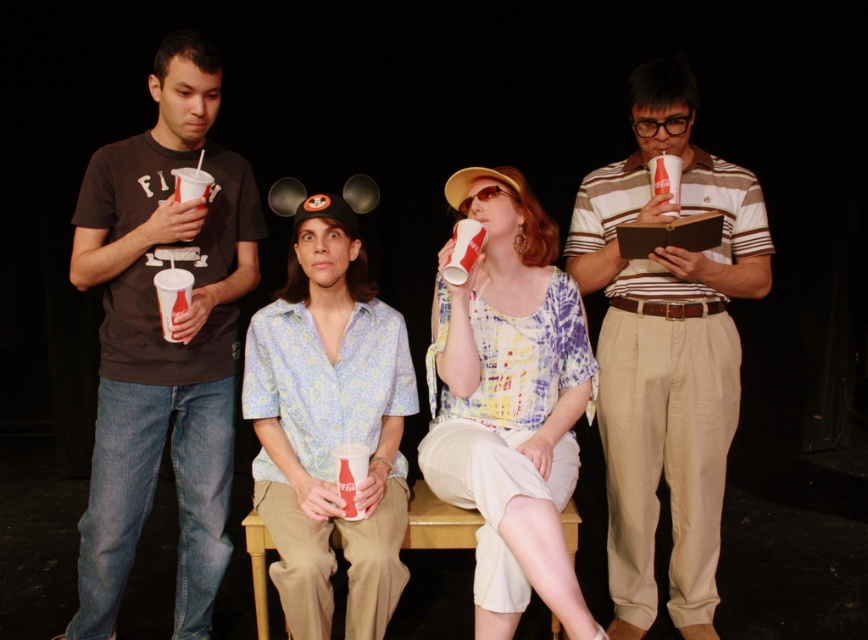
Question: Which point appears farthest from the camera in this image?

Choices:
 (A) (343, 308)
 (B) (220, 499)

Answer: (B)

Question: Which point is farther from the camera taking this photo?

Choices:
 (A) (215, 493)
 (B) (628, 586)
 (C) (360, 419)
 (D) (169, 310)

Answer: (B)

Question: Is matte black t-shirt at left smaller than matte paper cup at center?

Choices:
 (A) yes
 (B) no

Answer: (B)

Question: Can you confirm if matte floral shirt at center is positioned above white paper cup at left?

Choices:
 (A) yes
 (B) no

Answer: (B)

Question: Which object is positioned closest to the matte paper cup at center?

Choices:
 (A) white paper cup at left
 (B) matte floral shirt at center
 (C) matte black t-shirt at left
 (D) striped cotton shirt at center

Answer: (B)

Question: Is matte floral shirt at center bigger than white paper cup at left?

Choices:
 (A) no
 (B) yes

Answer: (B)